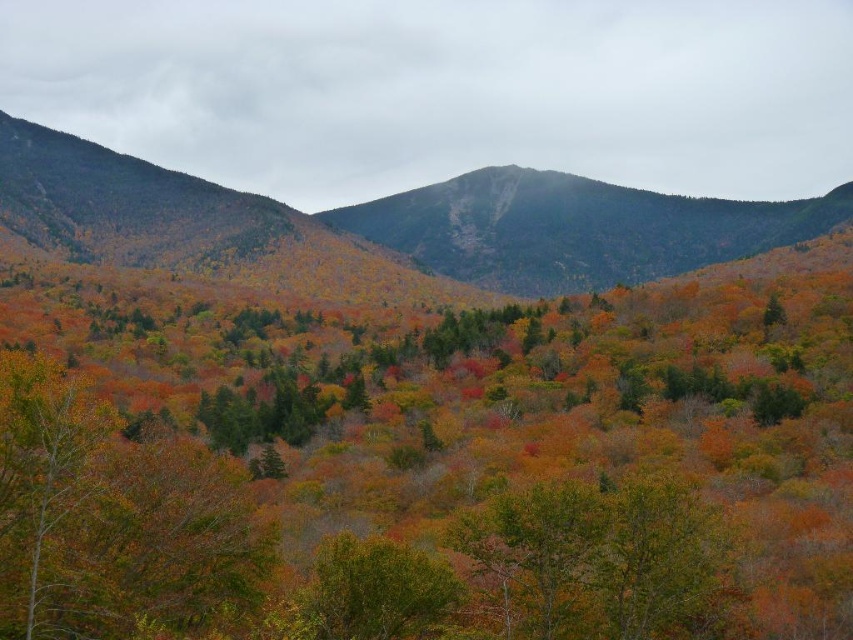
Question: Which point is closer to the camera?

Choices:
 (A) green matte tree at lower left
 (B) green matte tree at center

Answer: (B)

Question: Is smooth gray rock at center above green matte tree at center?

Choices:
 (A) yes
 (B) no

Answer: (A)

Question: Which object is positioned closest to the green textured mountain at center?

Choices:
 (A) autumn leaves at center
 (B) green matte tree at center
 (C) green matte tree at lower left
 (D) smooth gray rock at center

Answer: (D)

Question: Which point is farther to the camera?

Choices:
 (A) (367, 636)
 (B) (560, 179)
 (C) (27, 531)
 (D) (552, 397)

Answer: (B)

Question: Is green textured mountain at center thinner than smooth gray rock at center?

Choices:
 (A) yes
 (B) no

Answer: (B)

Question: Can you confirm if autumn leaves at center is smaller than smooth gray rock at center?

Choices:
 (A) no
 (B) yes

Answer: (A)